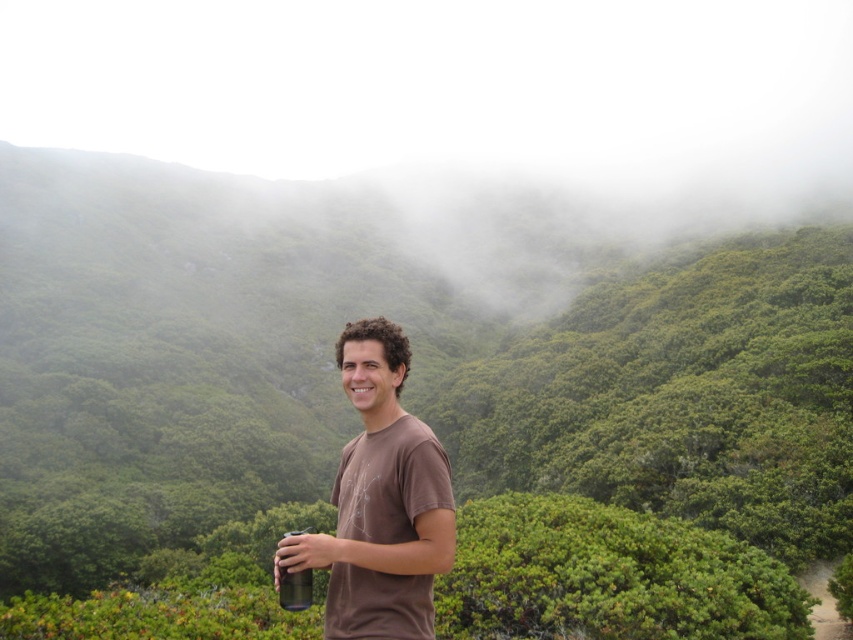
Is brown cotton t-shirt at center smaller than metallic silver cup at lower center?

Yes.

Does brown cotton t-shirt at center appear under metallic silver cup at lower center?

Incorrect, brown cotton t-shirt at center is not positioned below metallic silver cup at lower center.

Is point (367, 406) more distant than point (289, 534)?

That is False.

At what (x,y) coordinates should I click in order to perform the action: click on brown cotton t-shirt at center. Please return your answer as a coordinate pair (x, y). Looking at the image, I should click on (381, 500).